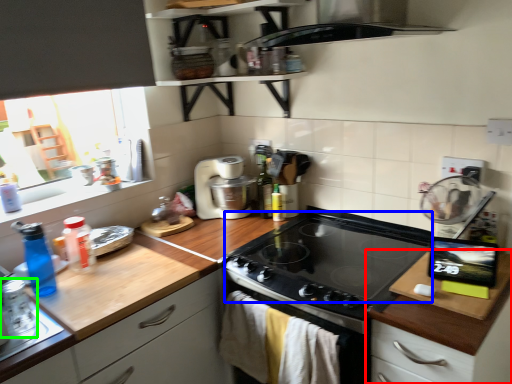
Question: Based on their relative distances, which object is farther from cabinetry (highlighted by a red box)? Choose from gas stove (highlighted by a blue box) and appliance (highlighted by a green box).

Choices:
 (A) gas stove
 (B) appliance

Answer: (B)